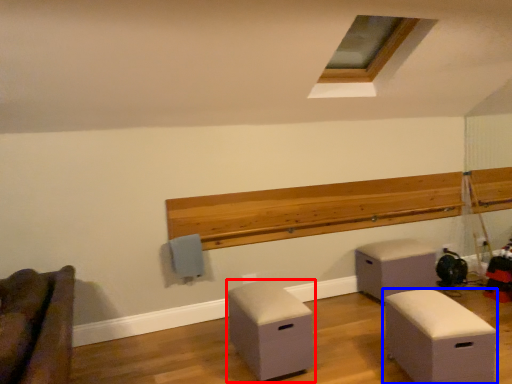
Question: Which point is further to the camera, furniture (highlighted by a red box) or furniture (highlighted by a blue box)?

Choices:
 (A) furniture
 (B) furniture

Answer: (A)